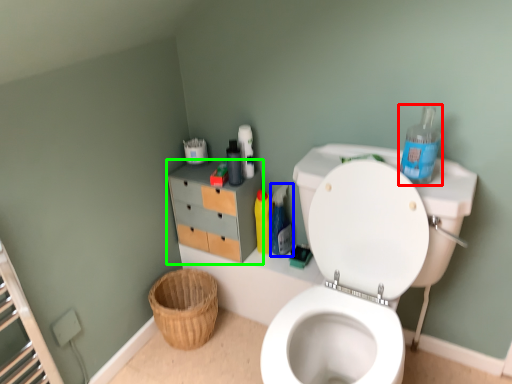
Question: Which object is the closest to the cleaning product (highlighted by a red box)? Choose among these: cleaning product (highlighted by a blue box) or file cabinet (highlighted by a green box).

Choices:
 (A) cleaning product
 (B) file cabinet

Answer: (A)